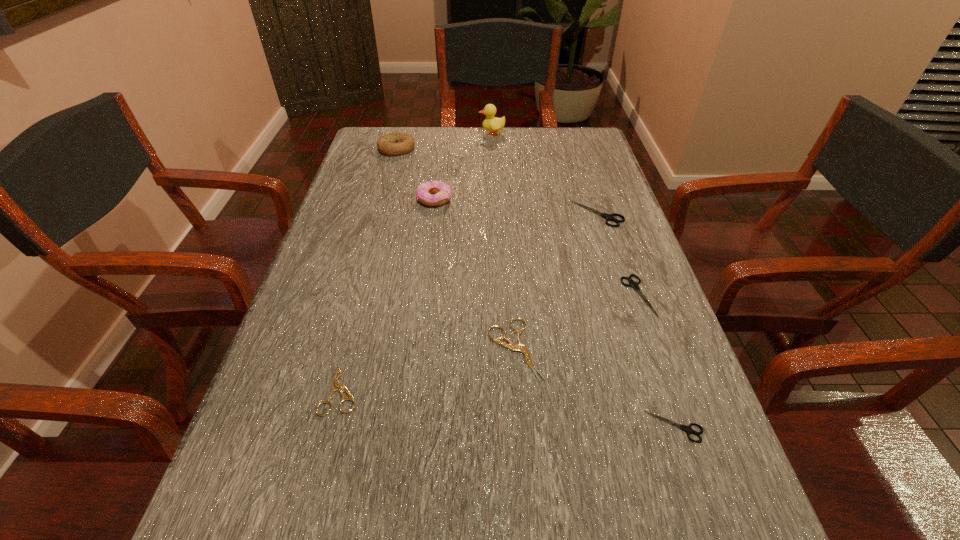
This screenshot has width=960, height=540. In order to click on duckling in this screenshot , I will do `click(493, 124)`.

Image resolution: width=960 pixels, height=540 pixels. I want to click on the farthest object, so click(493, 124).

The width and height of the screenshot is (960, 540). I want to click on bagel, so click(x=392, y=144).

Identify the location of the second farthest object. (392, 144).

Image resolution: width=960 pixels, height=540 pixels. What are the coordinates of `the sixth object from right to left` in the screenshot? It's located at (424, 191).

The image size is (960, 540). Identify the location of doughnut. (424, 191).

Identify the location of the tallest shears. The width and height of the screenshot is (960, 540). (609, 217).

Find the location of `the biggest black shears`. the biggest black shears is located at coordinates (609, 217).

Identify the location of the fourth nearest shears. (633, 284).

Image resolution: width=960 pixels, height=540 pixels. What are the coordinates of `the second nearest black shears` in the screenshot? It's located at (633, 284).